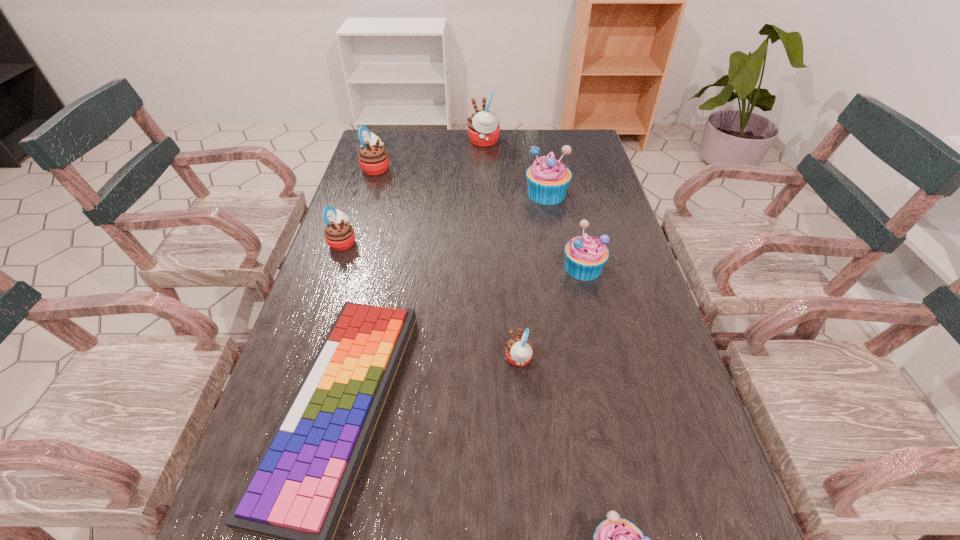
Find the location of a particular element. The image size is (960, 540). the second nearest muffin is located at coordinates (518, 350).

Where is `the smallest pink muffin`? the smallest pink muffin is located at coordinates (518, 350).

Identify the location of vacant space located on the front-facing side of the farthest muffin. (429, 142).

Where is `free space located 0.330m on the front-facing side of the farthest muffin`? free space located 0.330m on the front-facing side of the farthest muffin is located at coordinates (377, 142).

Where is `free region located on the front-facing side of the farthest muffin`? free region located on the front-facing side of the farthest muffin is located at coordinates (366, 142).

Identify the location of free point located on the front-facing side of the second farthest object. The width and height of the screenshot is (960, 540). (474, 168).

Identify the location of vacant space located 0.080m on the front of the biggest blue muffin. This screenshot has height=540, width=960. (552, 223).

Locate an element on the screen. The width and height of the screenshot is (960, 540). vacant space located 0.160m on the front-facing side of the fifth nearest object is located at coordinates (416, 242).

At what (x,y) coordinates should I click in order to perform the action: click on vacant area situated 0.060m on the back of the fourth nearest object. Please return your answer as a coordinate pair (x, y). This screenshot has height=540, width=960. Looking at the image, I should click on (576, 239).

Locate an element on the screen. Image resolution: width=960 pixels, height=540 pixels. free space located on the front-facing side of the smallest pink muffin is located at coordinates pyautogui.click(x=420, y=359).